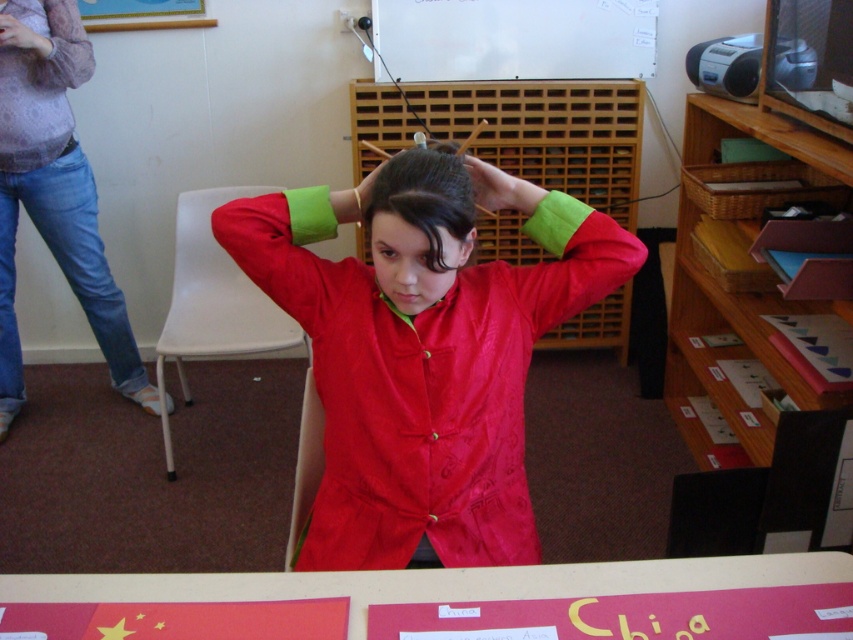
Who is positioned more to the right, shiny red jacket at center or matte red hand at upper center?

matte red hand at upper center is more to the right.

Can you confirm if shiny red jacket at center is shorter than matte red hand at upper center?

In fact, shiny red jacket at center may be taller than matte red hand at upper center.

Looking at this image, who is more forward, [625,253] or [509,177]?

Positioned in front is point [509,177].

This screenshot has height=640, width=853. What are the coordinates of `shiny red jacket at center` in the screenshot? It's located at (422, 355).

Is white matte board at upper center behind matte black hand at upper left?

That is True.

Can you confirm if white matte board at upper center is positioned below matte black hand at upper left?

Actually, white matte board at upper center is above matte black hand at upper left.

Describe the element at coordinates (514, 38) in the screenshot. I see `white matte board at upper center` at that location.

Find the location of a particular element. white matte board at upper center is located at coordinates coord(514,38).

Can you confirm if matte red jacket at center is wider than matte red hand at upper center?

Correct, the width of matte red jacket at center exceeds that of matte red hand at upper center.

Does matte red jacket at center have a greater height compared to matte red hand at upper center?

Indeed, matte red jacket at center has a greater height compared to matte red hand at upper center.

At what (x,y) coordinates should I click in order to perform the action: click on matte red jacket at center. Please return your answer as a coordinate pair (x, y). This screenshot has height=640, width=853. Looking at the image, I should click on (416, 225).